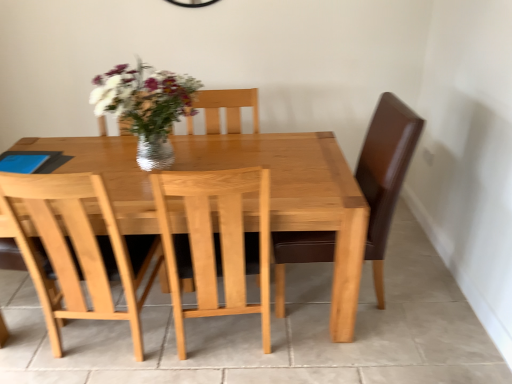
This screenshot has width=512, height=384. In order to click on unoccupied region to the right of light wood chair at center in this screenshot , I will do `click(313, 327)`.